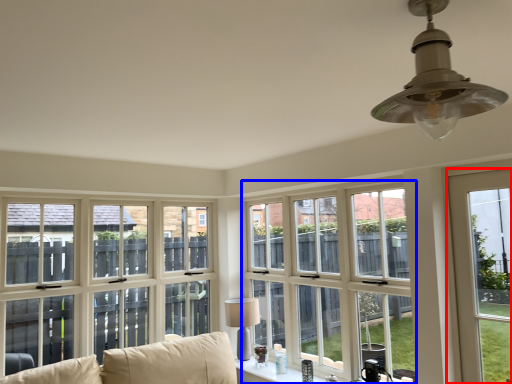
Question: Which point is closer to the camera, window (highlighted by a red box) or window (highlighted by a blue box)?

Choices:
 (A) window
 (B) window

Answer: (A)